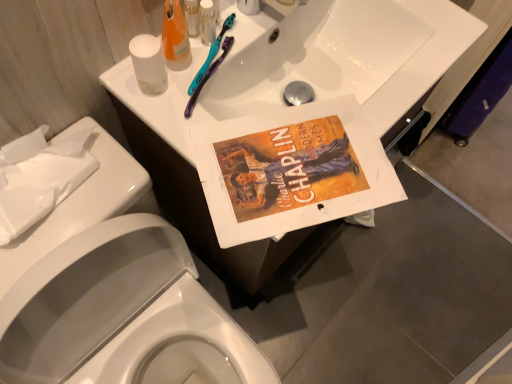
Question: Can you confirm if white glossy porcelain at upper center, which ranks as the 2th porcelain in back-to-front order, is positioned to the left of white paper towel at left, marked as the 2th porcelain in a front-to-back arrangement?

Choices:
 (A) yes
 (B) no

Answer: (B)

Question: From the image's perspective, is white glossy porcelain at upper center, the first porcelain when ordered from front to back, under white paper towel at left, the 1th porcelain in the back-to-front sequence?

Choices:
 (A) no
 (B) yes

Answer: (B)

Question: From a real-world perspective, does white glossy porcelain at upper center, the first porcelain when ordered from front to back, stand above white paper towel at left, marked as the 2th porcelain in a front-to-back arrangement?

Choices:
 (A) yes
 (B) no

Answer: (B)

Question: Is white glossy porcelain at upper center, which ranks as the 2th porcelain in back-to-front order, thinner than white paper towel at left, the 1th porcelain in the back-to-front sequence?

Choices:
 (A) no
 (B) yes

Answer: (A)

Question: Is white paper towel at left, the 1th porcelain in the back-to-front sequence, located within white glossy porcelain at upper center, which ranks as the 2th porcelain in back-to-front order?

Choices:
 (A) no
 (B) yes

Answer: (B)

Question: From the image's perspective, relative to white paper towel at left, the 1th porcelain in the back-to-front sequence, is white glossy sink at upper center above or below?

Choices:
 (A) below
 (B) above

Answer: (B)

Question: Is point (280, 13) closer or farther from the camera than point (95, 142)?

Choices:
 (A) farther
 (B) closer

Answer: (A)

Question: From a real-world perspective, is white glossy sink at upper center above or below white paper towel at left, the 1th porcelain in the back-to-front sequence?

Choices:
 (A) below
 (B) above

Answer: (A)

Question: Considering the positions of white glossy sink at upper center and white paper towel at left, the 1th porcelain in the back-to-front sequence, in the image, is white glossy sink at upper center wider or thinner than white paper towel at left, the 1th porcelain in the back-to-front sequence,?

Choices:
 (A) wide
 (B) thin

Answer: (A)

Question: From the image's perspective, is clear plastic bottle at upper center, which ranks as the second toiletry in left-to-right order, positioned above or below transparent plastic cup at upper left?

Choices:
 (A) above
 (B) below

Answer: (A)

Question: Is clear plastic bottle at upper center, placed as the 1th toiletry when sorted from right to left, wider or thinner than transparent plastic cup at upper left?

Choices:
 (A) wide
 (B) thin

Answer: (B)

Question: Is point (206, 43) positioned closer to the camera than point (129, 46)?

Choices:
 (A) farther
 (B) closer

Answer: (A)

Question: From their relative heights in the image, would you say clear plastic bottle at upper center, placed as the 1th toiletry when sorted from right to left, is taller or shorter than transparent plastic cup at upper left?

Choices:
 (A) short
 (B) tall

Answer: (A)

Question: From their relative heights in the image, would you say clear plastic bottle at upper center, placed as the 1th toiletry when sorted from right to left, is taller or shorter than white glossy porcelain at upper center, which ranks as the 2th porcelain in back-to-front order?

Choices:
 (A) tall
 (B) short

Answer: (B)

Question: From a real-world perspective, is clear plastic bottle at upper center, placed as the 1th toiletry when sorted from right to left, positioned above or below white glossy porcelain at upper center, which ranks as the 2th porcelain in back-to-front order?

Choices:
 (A) above
 (B) below

Answer: (A)